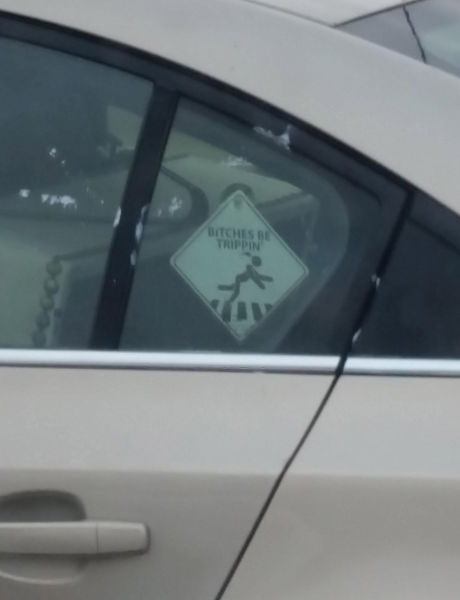
The height and width of the screenshot is (600, 460). I want to click on door handle, so click(x=59, y=529).